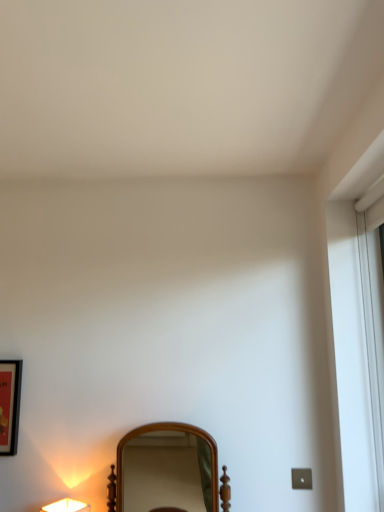
Question: From a real-world perspective, is matte white lamp at lower left positioned over matte black picture frame at left based on gravity?

Choices:
 (A) no
 (B) yes

Answer: (A)

Question: Is matte black picture frame at left completely or partially inside matte white lamp at lower left?

Choices:
 (A) yes
 (B) no

Answer: (B)

Question: Does matte white lamp at lower left appear on the right side of matte black picture frame at left?

Choices:
 (A) no
 (B) yes

Answer: (B)

Question: Can we say matte white lamp at lower left lies outside matte black picture frame at left?

Choices:
 (A) yes
 (B) no

Answer: (A)

Question: Considering the relative sizes of matte white lamp at lower left and matte black picture frame at left in the image provided, is matte white lamp at lower left bigger than matte black picture frame at left?

Choices:
 (A) yes
 (B) no

Answer: (A)

Question: Is point (142, 476) closer or farther from the camera than point (16, 432)?

Choices:
 (A) farther
 (B) closer

Answer: (A)

Question: Choose the correct answer: Is wooden mirror at center inside matte black picture frame at left or outside it?

Choices:
 (A) inside
 (B) outside

Answer: (B)

Question: Visually, is wooden mirror at center positioned to the left or to the right of matte black picture frame at left?

Choices:
 (A) right
 (B) left

Answer: (A)

Question: Based on their sizes in the image, would you say wooden mirror at center is bigger or smaller than matte black picture frame at left?

Choices:
 (A) small
 (B) big

Answer: (B)

Question: From the image's perspective, relative to matte black picture frame at left, is matte white lamp at lower left above or below?

Choices:
 (A) above
 (B) below

Answer: (B)

Question: Considering the positions of matte white lamp at lower left and matte black picture frame at left in the image, is matte white lamp at lower left bigger or smaller than matte black picture frame at left?

Choices:
 (A) small
 (B) big

Answer: (B)

Question: Considering the positions of matte white lamp at lower left and matte black picture frame at left in the image, is matte white lamp at lower left wider or thinner than matte black picture frame at left?

Choices:
 (A) wide
 (B) thin

Answer: (A)

Question: Relative to matte black picture frame at left, is matte white lamp at lower left in front or behind?

Choices:
 (A) behind
 (B) front

Answer: (B)

Question: From the image's perspective, is wooden mirror at center located above or below matte white lamp at lower left?

Choices:
 (A) above
 (B) below

Answer: (A)

Question: Which is correct: wooden mirror at center is inside matte white lamp at lower left, or outside of it?

Choices:
 (A) outside
 (B) inside

Answer: (A)